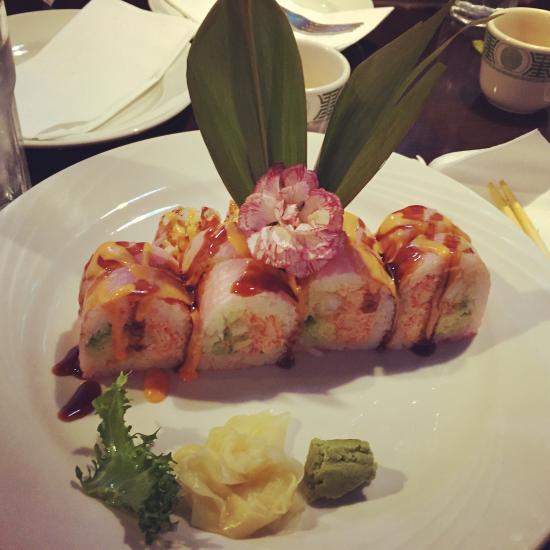
Where is `table`? The image size is (550, 550). table is located at coordinates (35, 159), (456, 113).